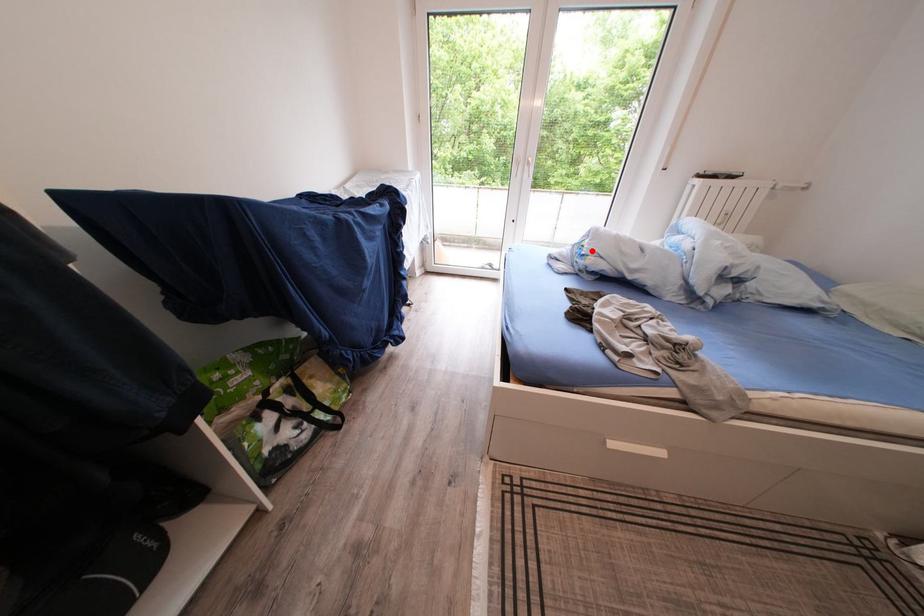
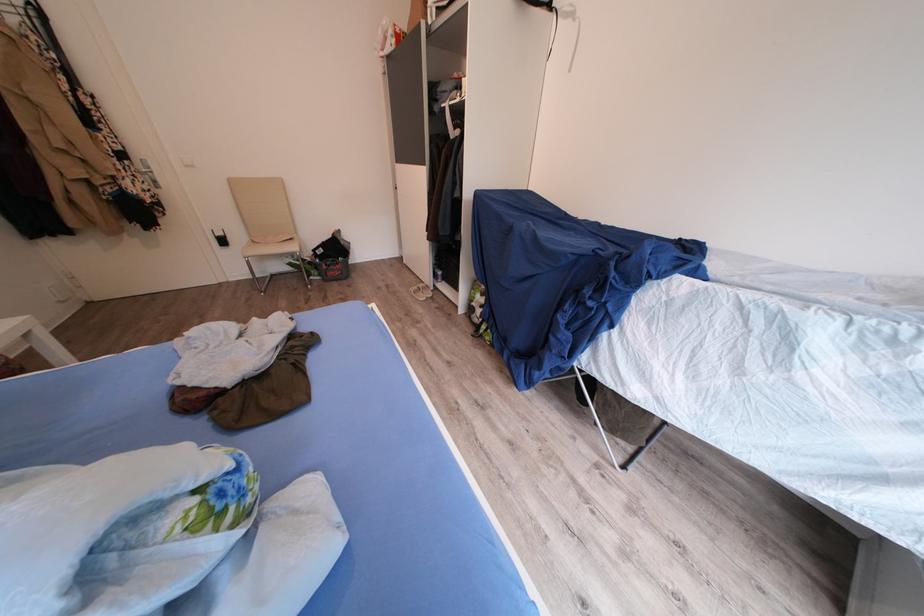
Find the pixel in the second image that matches the highlighted location in the first image.

(213, 507)